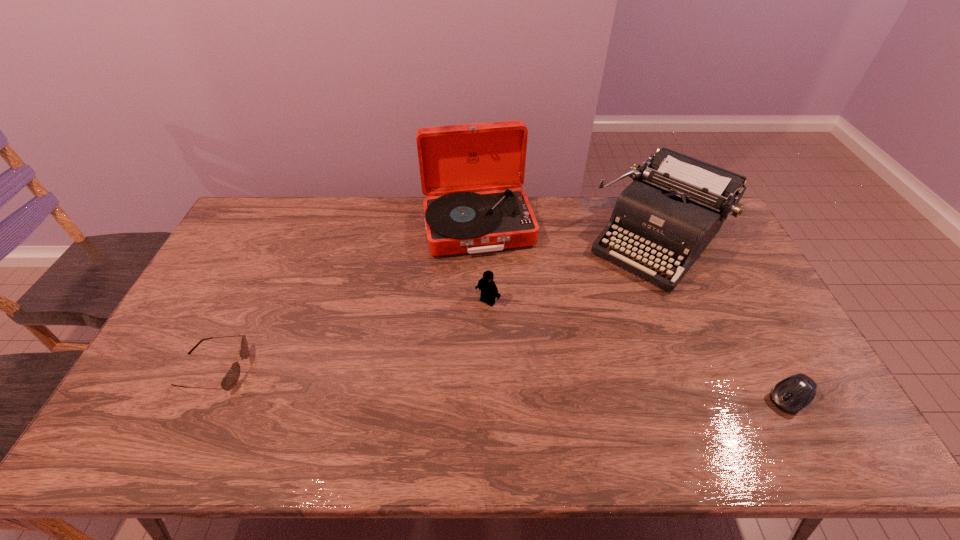
Locate an element on the screen. The image size is (960, 540). sunglasses is located at coordinates (231, 378).

The width and height of the screenshot is (960, 540). What are the coordinates of `mouse` in the screenshot? It's located at (790, 395).

Where is `the third shortest object`? the third shortest object is located at coordinates (489, 291).

Where is `the tallest object`? the tallest object is located at coordinates (455, 161).

Find the location of a particular element. The height and width of the screenshot is (540, 960). the second tallest object is located at coordinates (676, 204).

Find the location of `blank area located 0.380m on the front-facing side of the sunglasses`. blank area located 0.380m on the front-facing side of the sunglasses is located at coordinates (388, 369).

The width and height of the screenshot is (960, 540). In order to click on vacant space located 0.310m on the left of the mouse in this screenshot , I will do `click(645, 397)`.

Where is `vacant space located 0.300m on the face of the Lego`? This screenshot has height=540, width=960. vacant space located 0.300m on the face of the Lego is located at coordinates (418, 379).

Where is `free space located on the face of the Lego`? Image resolution: width=960 pixels, height=540 pixels. free space located on the face of the Lego is located at coordinates (x=424, y=371).

The height and width of the screenshot is (540, 960). Identify the location of vacant region located on the face of the Lego. (434, 361).